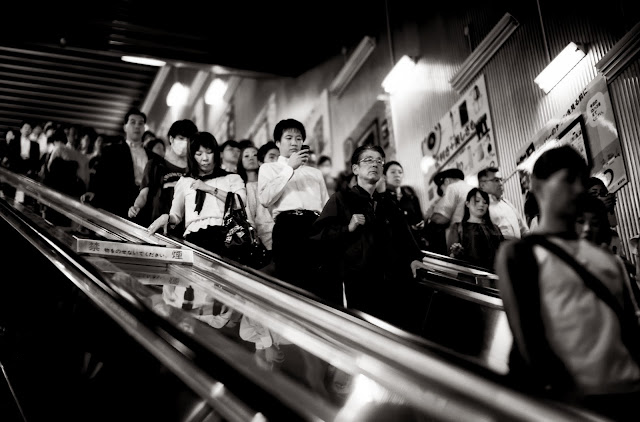
This screenshot has width=640, height=422. Identify the location of light. tap(562, 64), tap(397, 74), tap(214, 92), tap(178, 89), tap(141, 62).